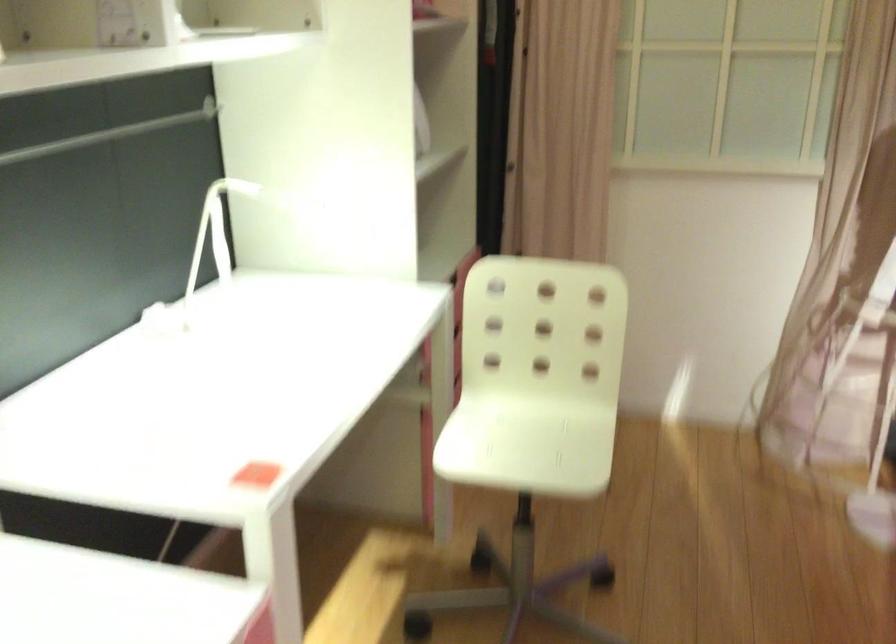
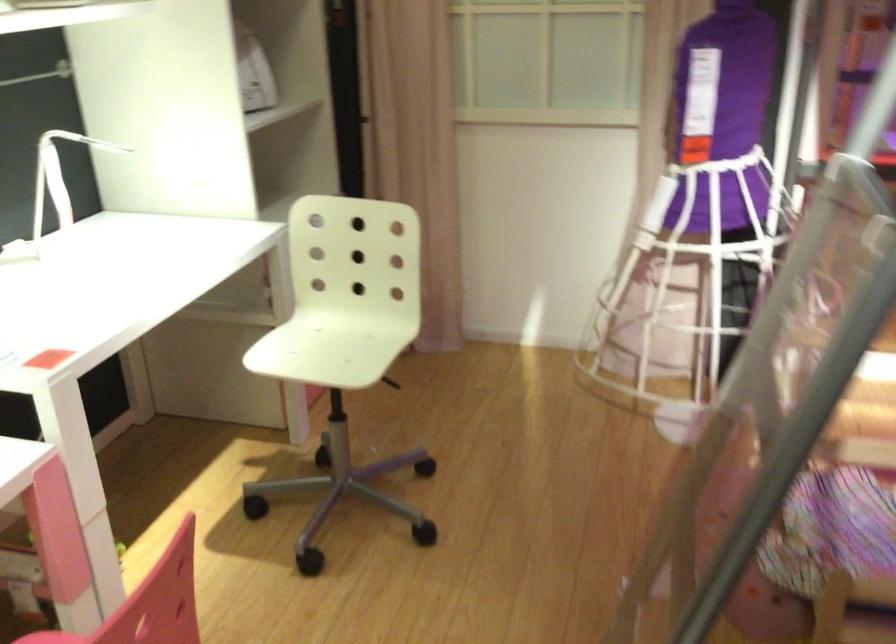
Where in the second image is the point corresponding to point (218, 240) from the first image?

(58, 176)